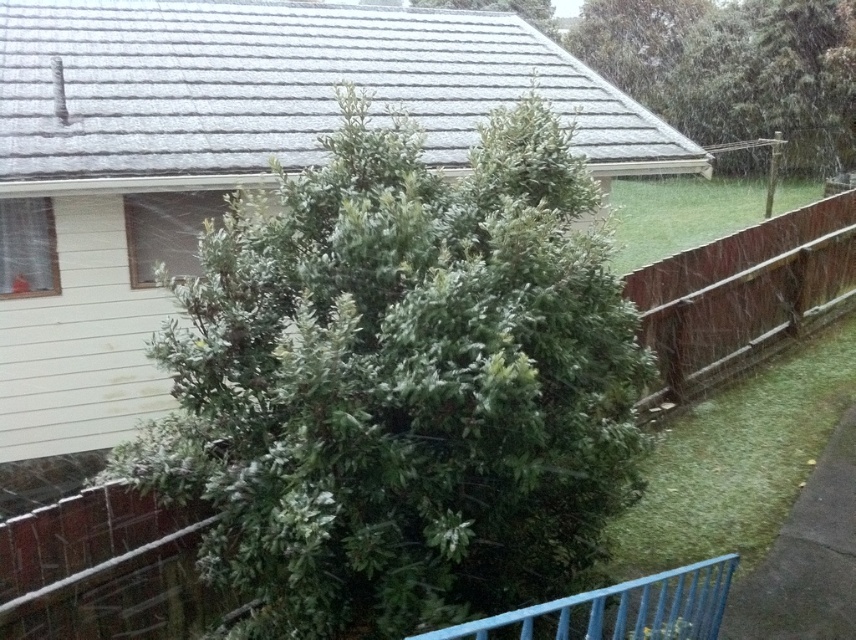
You are standing on a balcony and need to place a 2.5 meter long ladder between the brown wooden fence at right and the blue painted metal fence at lower center. Is there enough space for the ladder to fit horizontally between them?

The distance between the brown wooden fence at right and the blue painted metal fence at lower center is 3.89 meters. Since the ladder is 2.5 meters long, it can fit horizontally between them as there is sufficient space.

You are standing on the balcony and want to see the brown wooden fence at right. Is the blue painted metal fence at lower center blocking your view of it?

The blue painted metal fence at lower center is behind the brown wooden fence at right, so it is not blocking your view. You can see the brown wooden fence at right without any obstruction from the blue painted metal fence at lower center.